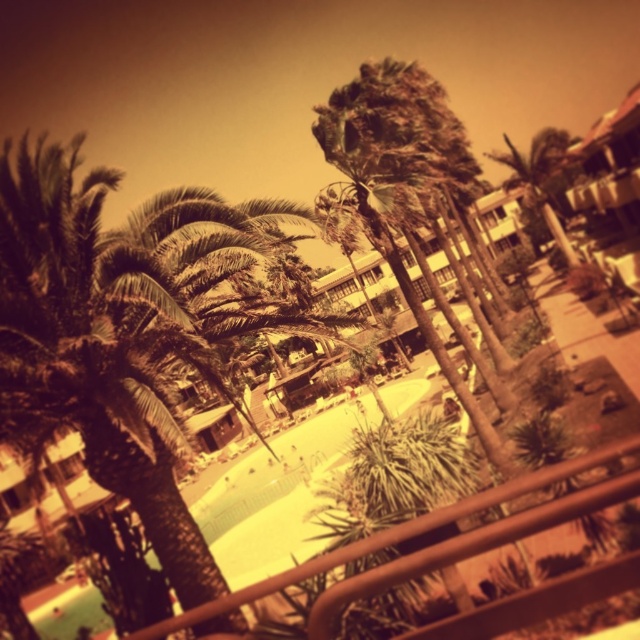
Question: Is brown metal railing at center positioned in front of green leafy palm tree at center?

Choices:
 (A) yes
 (B) no

Answer: (A)

Question: Can you confirm if brown metal railing at center is positioned to the left of green leafy palm tree at center?

Choices:
 (A) no
 (B) yes

Answer: (B)

Question: Among these objects, which one is nearest to the camera?

Choices:
 (A) brown metal railing at center
 (B) green leafy palm tree at center

Answer: (A)

Question: Which of the following is the farthest from the observer?

Choices:
 (A) (436, 513)
 (B) (538, 195)

Answer: (B)

Question: Can you confirm if brown metal railing at center is positioned below green leafy palm tree at center?

Choices:
 (A) yes
 (B) no

Answer: (A)